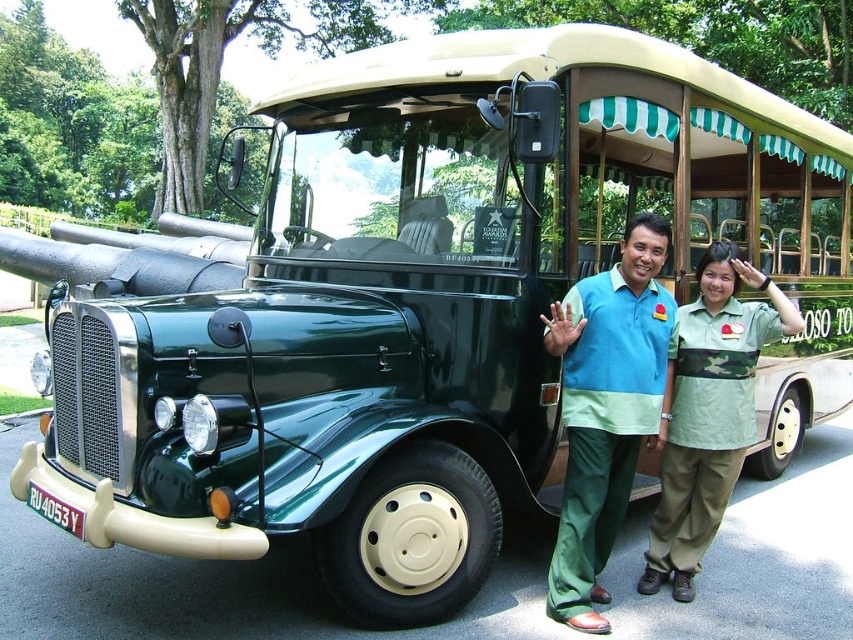
You are a photographer standing in front of the vintage bus. You notice a point marked at coordinate [607,408]. What object is located at that point?

The point at coordinate [607,408] indicates the blue green fabric shirt at center.